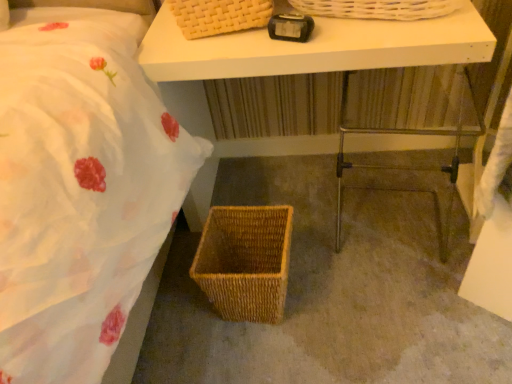
The image size is (512, 384). What are the coordinates of `free point below white matte table at upper center (from a real-world perspective)` in the screenshot? It's located at (288, 182).